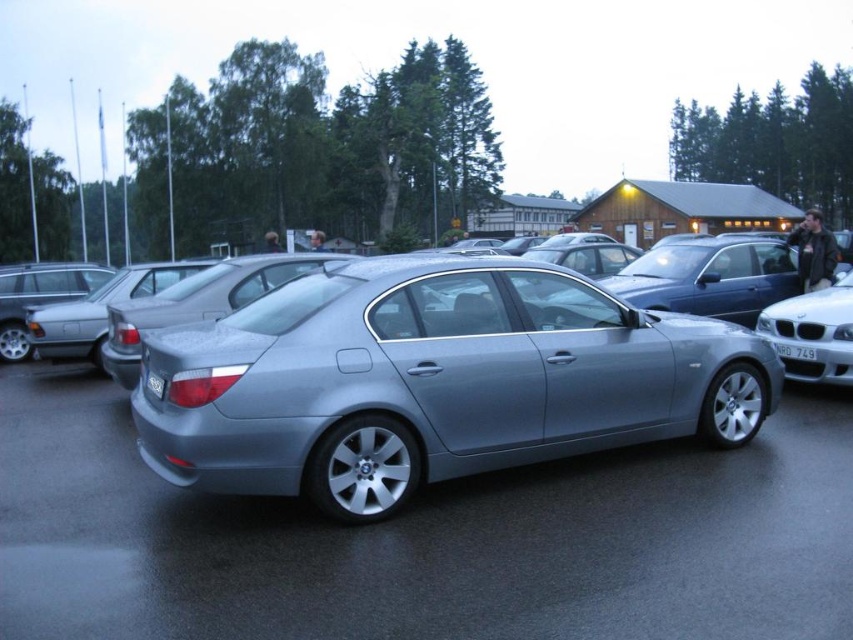
From the picture: You are a delivery person who needs to load a large package onto a cart. The package is 1.5 meters tall. You see the satin metallic sedan at center and the black plastic license plate at center. Which object is tall enough to avoid hitting the package when moving it past?

The satin metallic sedan at center is much taller than the black plastic license plate at center, so the package will not hit the sedan. However, the license plate is shorter, so you should ensure the package does not hit the black plastic license plate at center.